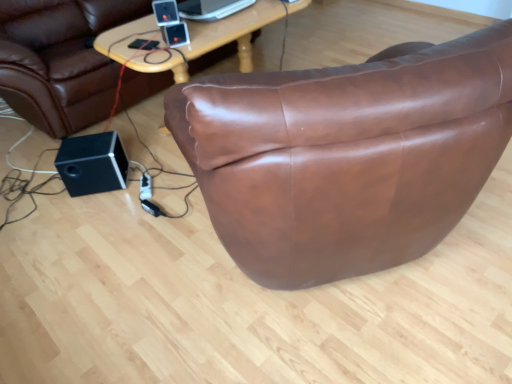
Question: Which direction should I rotate to face black plastic speaker at upper center, the first speaker viewed from the front, — up or down?

Choices:
 (A) up
 (B) down

Answer: (A)

Question: Can you confirm if satin black ipod at upper center is smaller than brown leather bean bag chair at center?

Choices:
 (A) yes
 (B) no

Answer: (A)

Question: Does satin black ipod at upper center have a larger size compared to brown leather bean bag chair at center?

Choices:
 (A) no
 (B) yes

Answer: (A)

Question: Does satin black ipod at upper center have a greater width compared to brown leather bean bag chair at center?

Choices:
 (A) yes
 (B) no

Answer: (B)

Question: Is satin black ipod at upper center touching brown leather bean bag chair at center?

Choices:
 (A) yes
 (B) no

Answer: (B)

Question: Is satin black ipod at upper center far from brown leather bean bag chair at center?

Choices:
 (A) no
 (B) yes

Answer: (A)

Question: From the image's perspective, does satin black ipod at upper center appear lower than brown leather bean bag chair at center?

Choices:
 (A) no
 (B) yes

Answer: (B)

Question: From a real-world perspective, is black plastic speaker at upper center, which is counted as the second speaker, starting from the back, on top of satin black ipod at upper center?

Choices:
 (A) yes
 (B) no

Answer: (A)

Question: Is black plastic speaker at upper center, which appears as the first speaker when viewed from the right, positioned with its back to satin black ipod at upper center?

Choices:
 (A) yes
 (B) no

Answer: (B)

Question: Can we say black plastic speaker at upper center, the 2th speaker positioned from the bottom, lies outside satin black ipod at upper center?

Choices:
 (A) yes
 (B) no

Answer: (A)

Question: Would you say black plastic speaker at upper center, which appears as the first speaker when viewed from the right, contains satin black ipod at upper center?

Choices:
 (A) no
 (B) yes

Answer: (A)

Question: Considering the relative sizes of black plastic speaker at upper center, the 1th speaker when ordered from top to bottom, and satin black ipod at upper center in the image provided, is black plastic speaker at upper center, the 1th speaker when ordered from top to bottom, smaller than satin black ipod at upper center?

Choices:
 (A) no
 (B) yes

Answer: (A)

Question: Is black plastic speaker at upper center, which appears as the first speaker when viewed from the right, at the left side of satin black ipod at upper center?

Choices:
 (A) no
 (B) yes

Answer: (B)

Question: Is the position of brown leather bean bag chair at center more distant than that of black plastic speaker at upper center, which appears as the first speaker when viewed from the right?

Choices:
 (A) yes
 (B) no

Answer: (A)